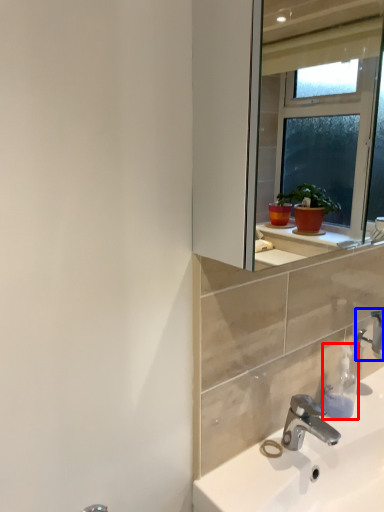
Question: Among these objects, which one is farthest to the camera, soap dispenser (highlighted by a red box) or tap (highlighted by a blue box)?

Choices:
 (A) soap dispenser
 (B) tap

Answer: (B)